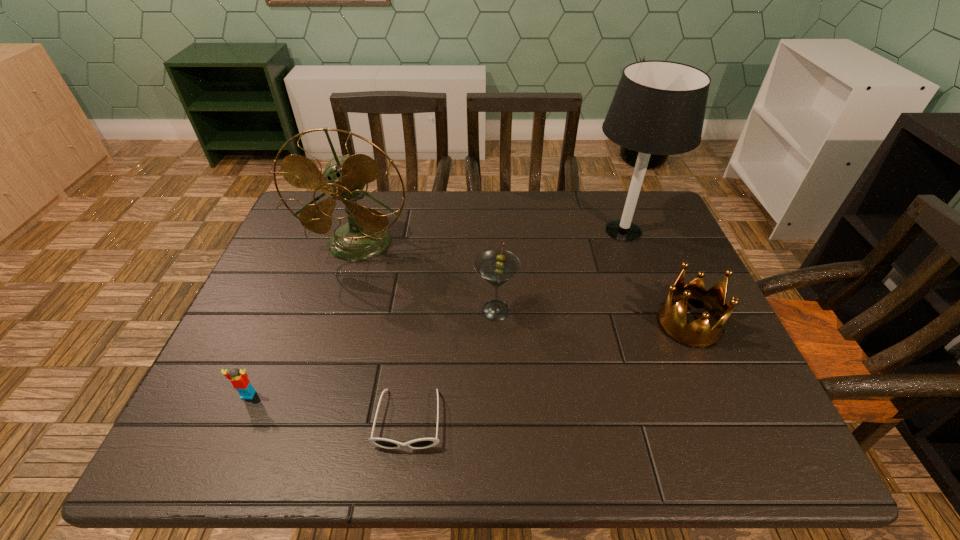
Where is `vacant point that satisfies the following two spatial constraints: 1. on the front side of the tallest object; 2. on the right side of the third shortest object`? Image resolution: width=960 pixels, height=540 pixels. vacant point that satisfies the following two spatial constraints: 1. on the front side of the tallest object; 2. on the right side of the third shortest object is located at coordinates (659, 323).

Locate an element on the screen. Image resolution: width=960 pixels, height=540 pixels. vacant position in the image that satisfies the following two spatial constraints: 1. on the back side of the fourth shortest object; 2. on the right side of the tallest object is located at coordinates (493, 231).